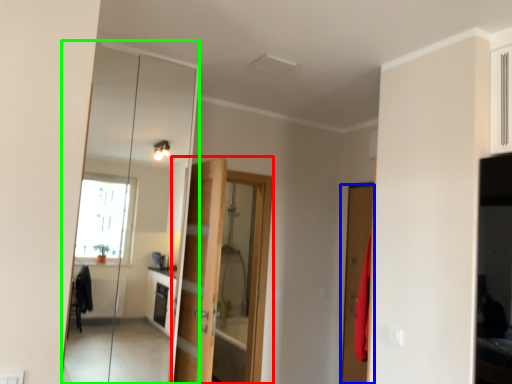
Question: Based on their relative distances, which object is nearer to door (highlighted by a red box)? Choose from door (highlighted by a blue box) and mirror (highlighted by a green box).

Choices:
 (A) door
 (B) mirror

Answer: (A)